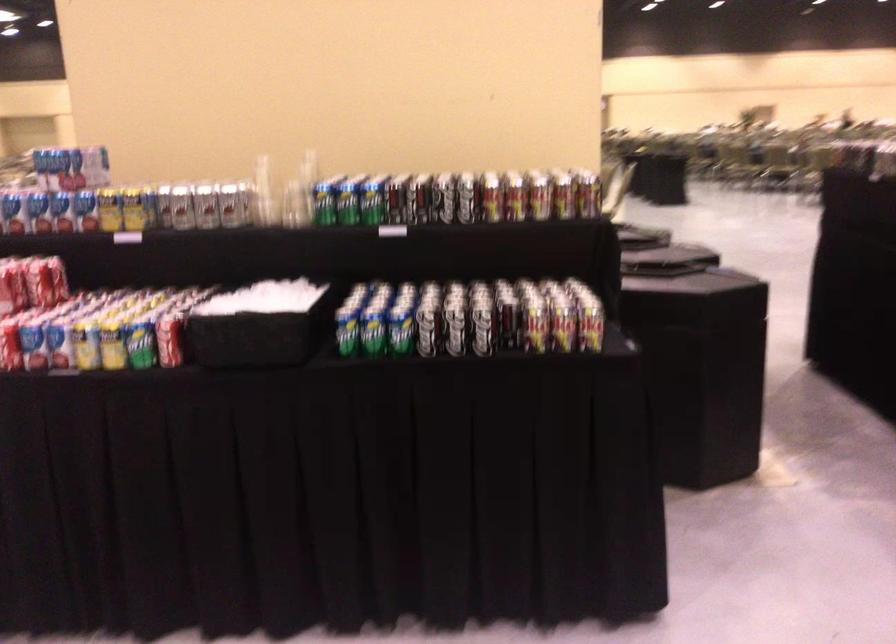
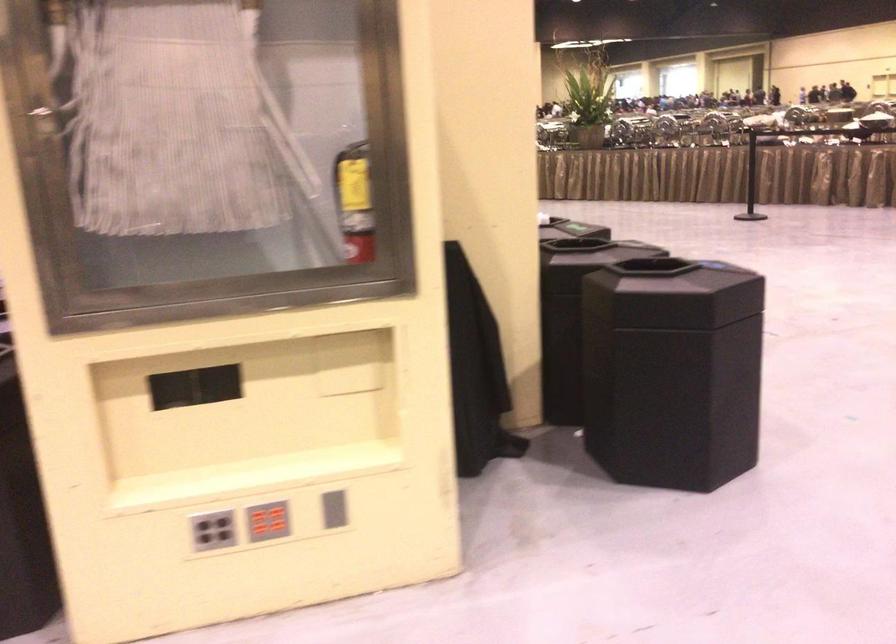
Question: I am providing you with two images of the same scene from different viewpoints. Please identify which objects are invisible in image2.

Choices:
 (A) green soda can
 (B) black trash can lid
 (C) red button panel
 (D) green video game case

Answer: (A)